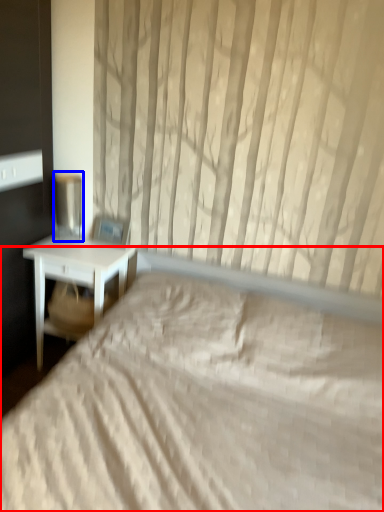
Question: Which point is further to the camera, bed (highlighted by a red box) or table lamp (highlighted by a blue box)?

Choices:
 (A) bed
 (B) table lamp

Answer: (B)